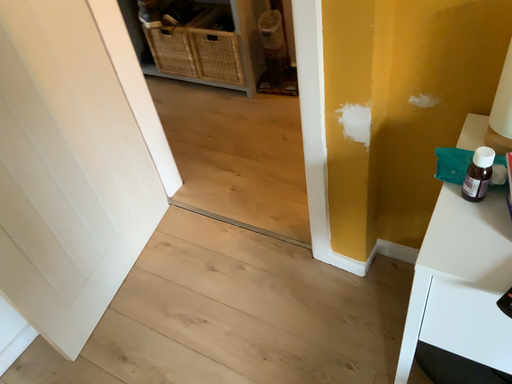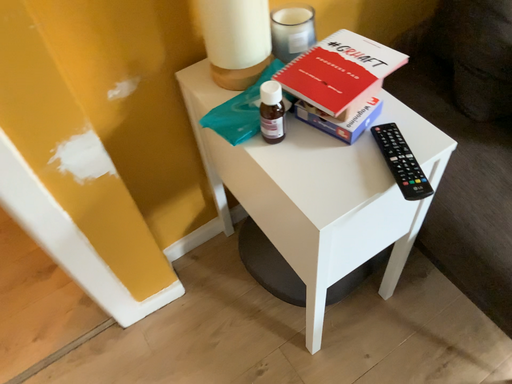
Question: How did the camera likely rotate when shooting the video?

Choices:
 (A) rotated downward
 (B) rotated upward

Answer: (B)